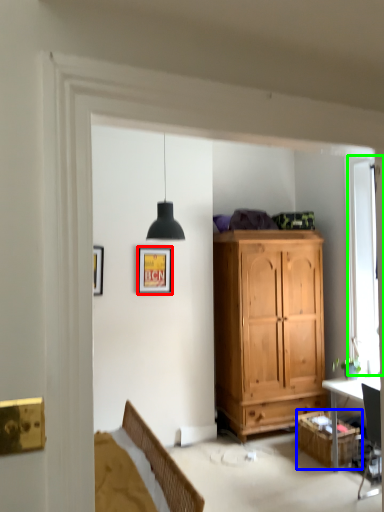
Question: Considering the real-world distances, which object is farthest from picture frame (highlighted by a red box)? cabinetry (highlighted by a blue box) or window (highlighted by a green box)?

Choices:
 (A) cabinetry
 (B) window

Answer: (A)